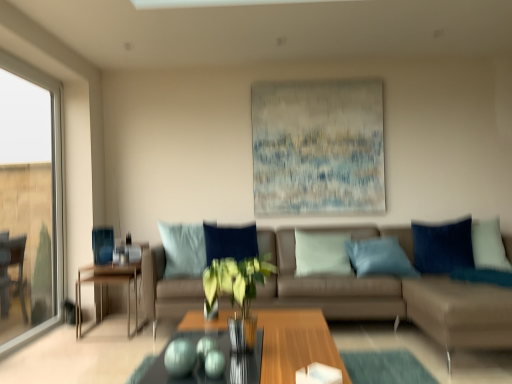
Question: Is textured canvas painting at upper center positioned far away from wooden table at left?

Choices:
 (A) yes
 (B) no

Answer: (A)

Question: Is textured canvas painting at upper center not inside wooden table at left?

Choices:
 (A) yes
 (B) no

Answer: (A)

Question: Considering the relative sizes of textured canvas painting at upper center and wooden table at left in the image provided, is textured canvas painting at upper center taller than wooden table at left?

Choices:
 (A) no
 (B) yes

Answer: (B)

Question: Can you confirm if textured canvas painting at upper center is wider than wooden table at left?

Choices:
 (A) no
 (B) yes

Answer: (A)

Question: Can you confirm if textured canvas painting at upper center is bigger than wooden table at left?

Choices:
 (A) yes
 (B) no

Answer: (B)

Question: Does point (135, 269) appear closer or farther from the camera than point (23, 221)?

Choices:
 (A) closer
 (B) farther

Answer: (A)

Question: From the image's perspective, relative to transparent glass window at left, is wooden table at left above or below?

Choices:
 (A) above
 (B) below

Answer: (B)

Question: Is wooden table at left in front of or behind transparent glass window at left in the image?

Choices:
 (A) front
 (B) behind

Answer: (B)

Question: From a real-world perspective, is wooden table at left positioned above or below transparent glass window at left?

Choices:
 (A) below
 (B) above

Answer: (A)

Question: Is wooden table at left in front of or behind green leafy plant in glass vase at center in the image?

Choices:
 (A) front
 (B) behind

Answer: (B)

Question: In terms of height, does wooden table at left look taller or shorter compared to green leafy plant in glass vase at center?

Choices:
 (A) short
 (B) tall

Answer: (B)

Question: Choose the correct answer: Is wooden table at left inside green leafy plant in glass vase at center or outside it?

Choices:
 (A) inside
 (B) outside

Answer: (B)

Question: Looking at their shapes, would you say wooden table at left is wider or thinner than green leafy plant in glass vase at center?

Choices:
 (A) wide
 (B) thin

Answer: (A)

Question: Relative to wooden table at left, is velvet blue pillow at right in front or behind?

Choices:
 (A) behind
 (B) front

Answer: (A)

Question: Considering the positions of point (415, 241) and point (136, 319), is point (415, 241) closer or farther from the camera than point (136, 319)?

Choices:
 (A) closer
 (B) farther

Answer: (B)